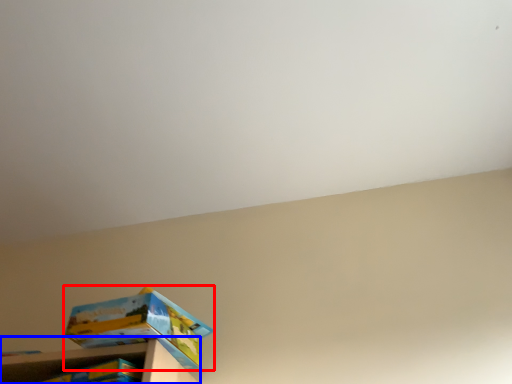
Question: Which point is further to the camera, box (highlighted by a red box) or shelf (highlighted by a blue box)?

Choices:
 (A) box
 (B) shelf

Answer: (A)